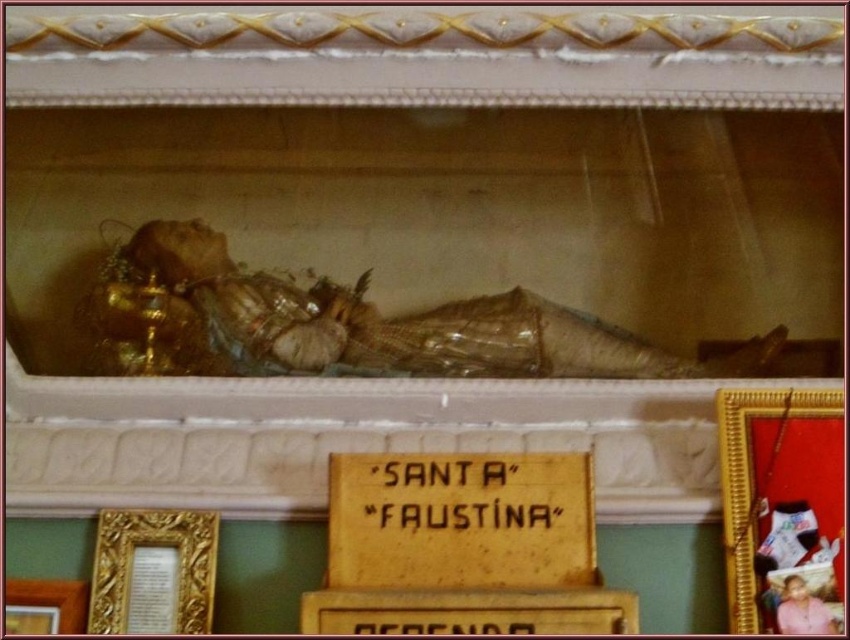
Question: Does wooden plaque at center have a smaller size compared to gold-framed picture at lower left?

Choices:
 (A) yes
 (B) no

Answer: (B)

Question: Which point is farther to the camera?

Choices:
 (A) (x=799, y=556)
 (B) (x=37, y=584)

Answer: (B)

Question: Which point is farther to the camera?

Choices:
 (A) (758, 561)
 (B) (434, 628)

Answer: (A)

Question: Estimate the real-world distances between objects in this image. Which object is farther from the gold-framed picture at center?

Choices:
 (A) gold-framed picture at lower left
 (B) yellow wood sign at center

Answer: (A)

Question: Is gold ornate frame at lower left positioned before gold-framed picture at lower left?

Choices:
 (A) yes
 (B) no

Answer: (B)

Question: Is the position of gold-framed picture at center more distant than that of gold ornate frame at lower left?

Choices:
 (A) yes
 (B) no

Answer: (B)